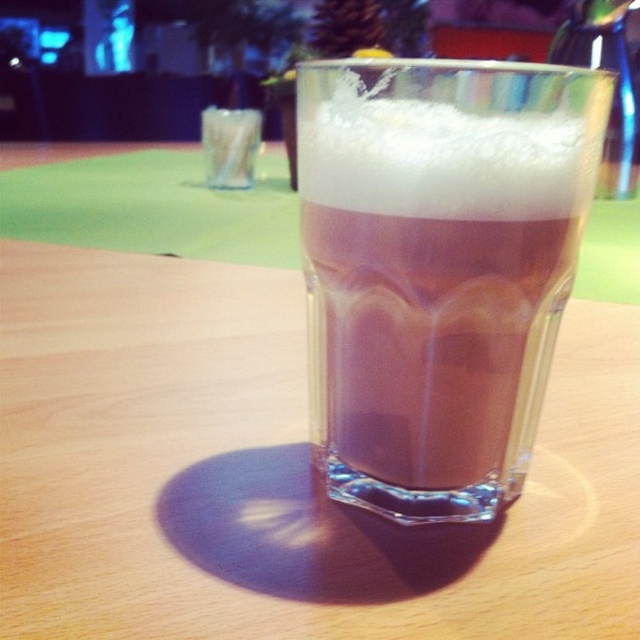
Is point (497, 177) behind point (348, 26)?

No, it is in front of (348, 26).

Which is behind, point (413, 124) or point (342, 29)?

The point (342, 29) is more distant.

What do you see at coordinates (438, 268) in the screenshot? The width and height of the screenshot is (640, 640). I see `brown frothy beverage at center` at bounding box center [438, 268].

Identify the location of brown frothy beverage at center. (438, 268).

Is point (486, 195) in front of point (317, 22)?

Yes, it is.

Which is more to the left, white fluffy foam at center or green fuzzy pine cone at upper center?

Positioned to the left is green fuzzy pine cone at upper center.

Describe the element at coordinates (442, 161) in the screenshot. Image resolution: width=640 pixels, height=640 pixels. I see `white fluffy foam at center` at that location.

The width and height of the screenshot is (640, 640). Find the location of `white fluffy foam at center`. white fluffy foam at center is located at coordinates (442, 161).

Who is taller, brown frothy beverage at center or white fluffy foam at center?

With more height is brown frothy beverage at center.

Does point (388, 508) lie behind point (572, 120)?

That is True.

Does point (368, 282) come farther from viewer compared to point (499, 173)?

Yes, it is.

Where is `brown frothy beverage at center`? The height and width of the screenshot is (640, 640). brown frothy beverage at center is located at coordinates (438, 268).